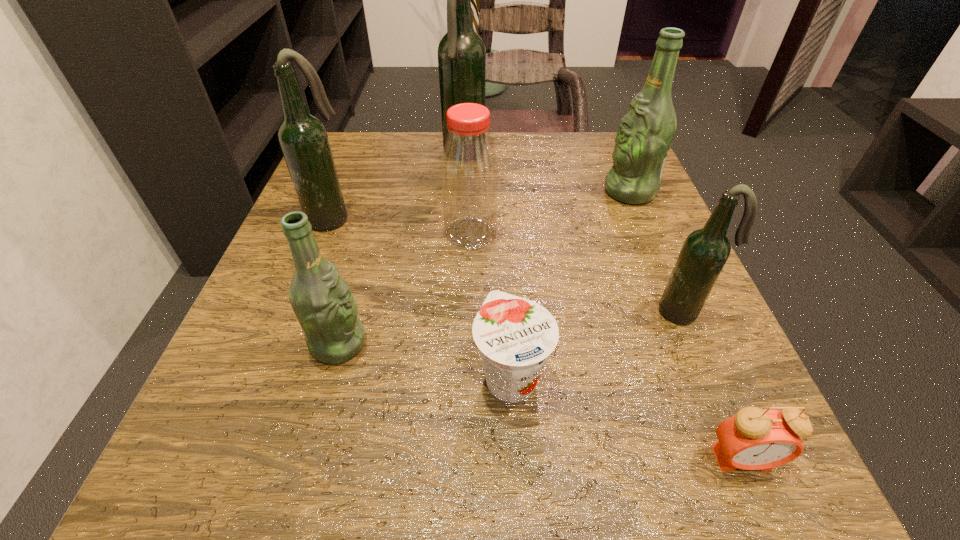
Identify the location of free point that satisfies the following two spatial constraints: 1. on the surface of the yogurt; 2. on the left side of the seventh object from right to left. This screenshot has height=540, width=960. (329, 376).